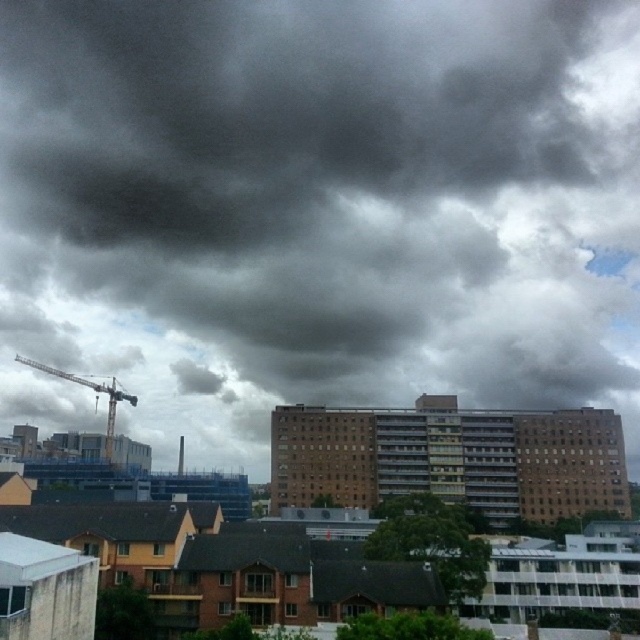
Question: Can you confirm if dark gray cloud at upper center is positioned above metallic gray crane at left?

Choices:
 (A) yes
 (B) no

Answer: (A)

Question: From the image, what is the correct spatial relationship of dark gray cloud at upper center in relation to metallic gray crane at left?

Choices:
 (A) right
 (B) left

Answer: (A)

Question: Among these points, which one is farthest from the camera?

Choices:
 (A) (109, 436)
 (B) (68, 412)

Answer: (B)

Question: Does dark gray cloud at upper center have a lesser width compared to metallic gray crane at left?

Choices:
 (A) no
 (B) yes

Answer: (A)

Question: Which point appears farthest from the camera in this image?

Choices:
 (A) (298, 369)
 (B) (109, 381)

Answer: (A)